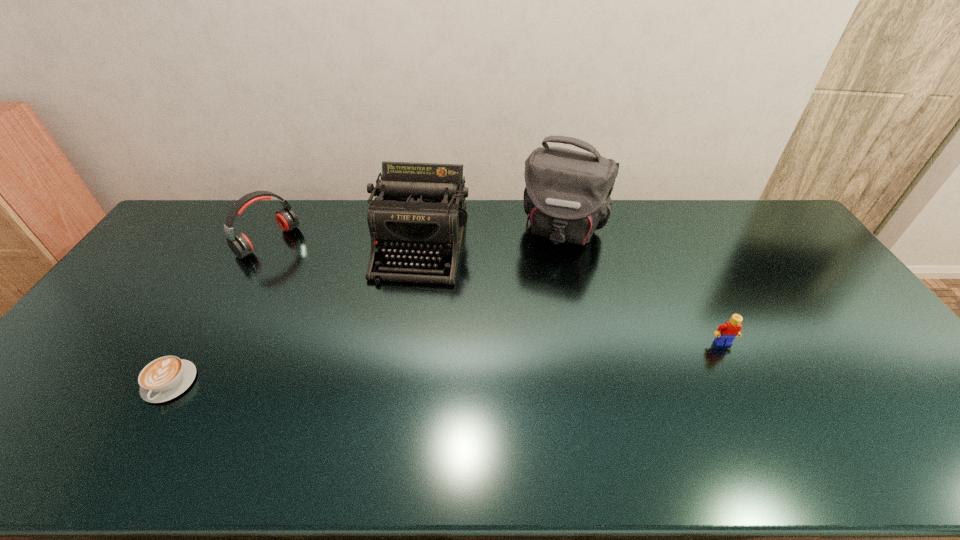
Where is `vacant space on the desktop that is between the shortest object and the Lego and is positioned on the keyboard of the third object from right to left`? vacant space on the desktop that is between the shortest object and the Lego and is positioned on the keyboard of the third object from right to left is located at coordinates coord(388,367).

Image resolution: width=960 pixels, height=540 pixels. Identify the location of free space on the desktop that is between the nearest object and the fourth tallest object and is positioned on the ear cups of the earphone. (x=451, y=362).

You are a GUI agent. You are given a task and a screenshot of the screen. Output one action in this format:
    pyautogui.click(x=<x>, y=<y>)
    Task: Click on the vacant space on the desktop that is between the shortest object and the fourth tallest object and is positioned on the open flap of the tallest object
    
    Given the screenshot: What is the action you would take?
    pyautogui.click(x=523, y=357)